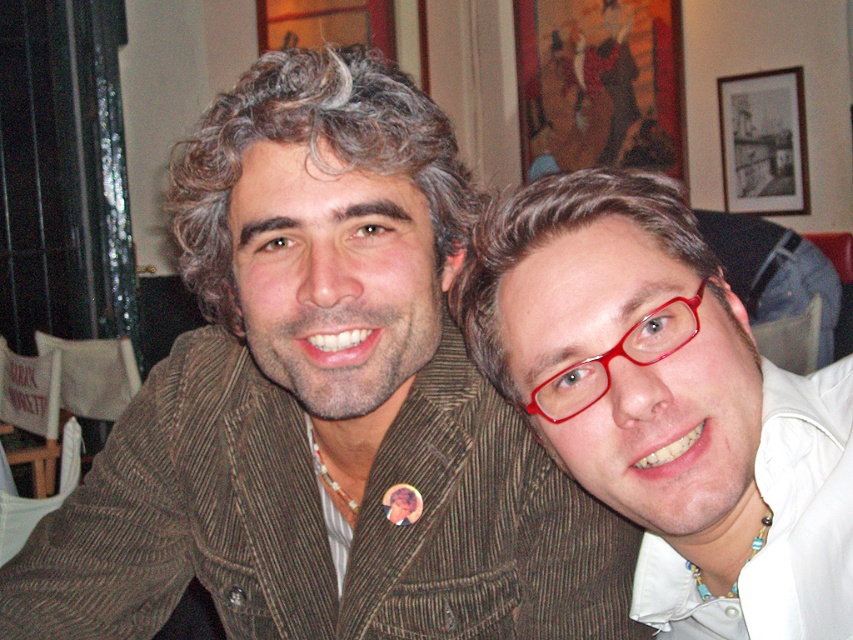
Question: Is the position of brown corduroy jacket at center less distant than that of matte red glasses at center?

Choices:
 (A) no
 (B) yes

Answer: (A)

Question: Does brown corduroy jacket at center have a lesser width compared to matte red glasses at center?

Choices:
 (A) no
 (B) yes

Answer: (A)

Question: Does brown corduroy jacket at center have a greater width compared to black matte picture frame at upper right?

Choices:
 (A) no
 (B) yes

Answer: (B)

Question: Which is farther from the brown corduroy jacket at center?

Choices:
 (A) black matte picture frame at upper right
 (B) matte red glasses at center

Answer: (A)

Question: Estimate the real-world distances between objects in this image. Which object is closer to the black matte picture frame at upper right?

Choices:
 (A) brown corduroy jacket at center
 (B) matte red glasses at center

Answer: (A)

Question: Among these objects, which one is farthest from the camera?

Choices:
 (A) matte red glasses at center
 (B) brown corduroy jacket at center
 (C) black matte picture frame at upper right

Answer: (C)